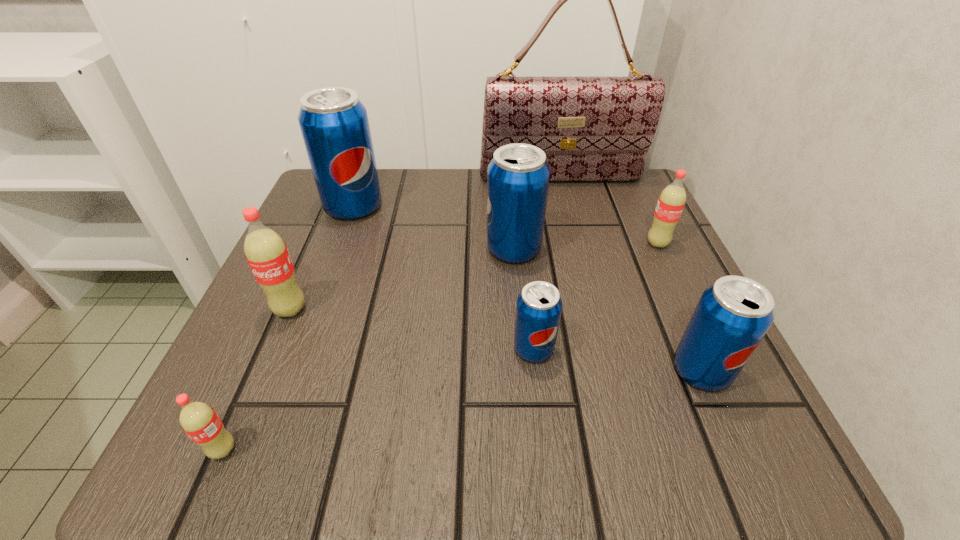
Where is `free spot between the leftmost blue pop soda and the smallest blue pop soda`? free spot between the leftmost blue pop soda and the smallest blue pop soda is located at coordinates coord(444,278).

You are a GUI agent. You are given a task and a screenshot of the screen. Output one action in this format:
    pyautogui.click(x=<x>, y=<y>)
    Task: Click on the free point between the handbag and the second biggest red soda
    
    Given the screenshot: What is the action you would take?
    pyautogui.click(x=609, y=211)

Where is `vacant area that lies between the second smallest blue pop soda and the handbag`? The width and height of the screenshot is (960, 540). vacant area that lies between the second smallest blue pop soda and the handbag is located at coordinates (631, 274).

This screenshot has height=540, width=960. In order to click on empty space that is in between the second farthest blue pop soda and the biggest red soda in this screenshot , I will do coord(402,279).

Locate which object is the seventh closest to the second smallest red soda. Please provide its 2D coordinates. Your answer should be formatted as a tuple, i.e. [(x, y)], where the tuple contains the x and y coordinates of a point satisfying the conditions above.

[(198, 420)]

Locate an element on the screen. the second closest object to the seventh shortest object is located at coordinates (266, 252).

Identify which soda is the second nearest to the third nearest blue pop soda. Please provide its 2D coordinates. Your answer should be formatted as a tuple, i.e. [(x, y)], where the tuple contains the x and y coordinates of a point satisfying the conditions above.

[(671, 201)]

At what (x,y) coordinates should I click in order to perform the action: click on soda that stands as the fifth closest to the second smallest red soda. Please return your answer as a coordinate pair (x, y). Image resolution: width=960 pixels, height=540 pixels. Looking at the image, I should click on (266, 252).

In order to click on blue pop soda object that ranks as the third closest to the smallest red soda in this screenshot , I will do `click(334, 123)`.

Locate an element on the screen. blue pop soda object that ranks as the third closest to the brown handbag is located at coordinates (538, 311).